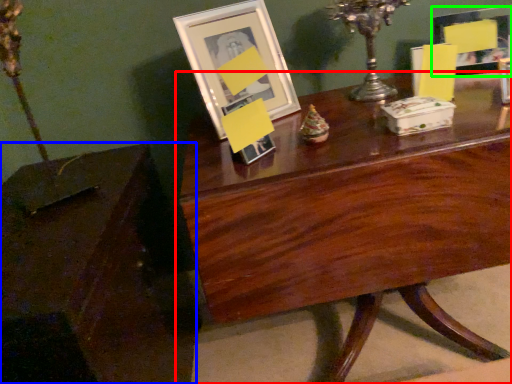
Question: Estimate the real-world distances between objects in this image. Which object is closer to table (highlighted by a red box), table (highlighted by a blue box) or picture frame (highlighted by a green box)?

Choices:
 (A) table
 (B) picture frame

Answer: (A)